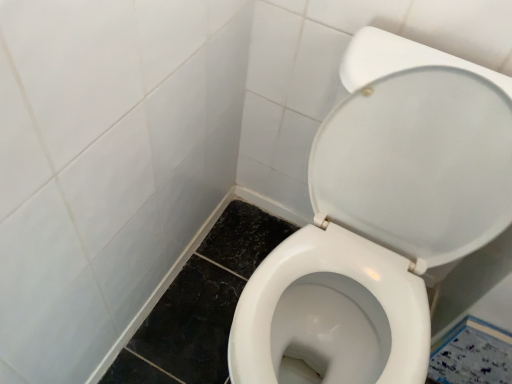
Question: Is white glossy tile at lower right bigger or smaller than white glossy toilet at center?

Choices:
 (A) big
 (B) small

Answer: (B)

Question: Does point [x=438, y=344] appear closer or farther from the camera than point [x=328, y=317]?

Choices:
 (A) farther
 (B) closer

Answer: (A)

Question: From a real-world perspective, relative to white glossy toilet at center, is white glossy tile at lower right vertically above or below?

Choices:
 (A) below
 (B) above

Answer: (A)

Question: From their relative heights in the image, would you say white glossy toilet at center is taller or shorter than white glossy tile at lower right?

Choices:
 (A) tall
 (B) short

Answer: (A)

Question: Is white glossy toilet at center in front of or behind white glossy tile at lower right in the image?

Choices:
 (A) behind
 (B) front

Answer: (B)

Question: From the image's perspective, relative to white glossy tile at lower right, is white glossy toilet at center above or below?

Choices:
 (A) below
 (B) above

Answer: (B)

Question: Is white glossy toilet at center bigger or smaller than white glossy tile at lower right?

Choices:
 (A) big
 (B) small

Answer: (A)